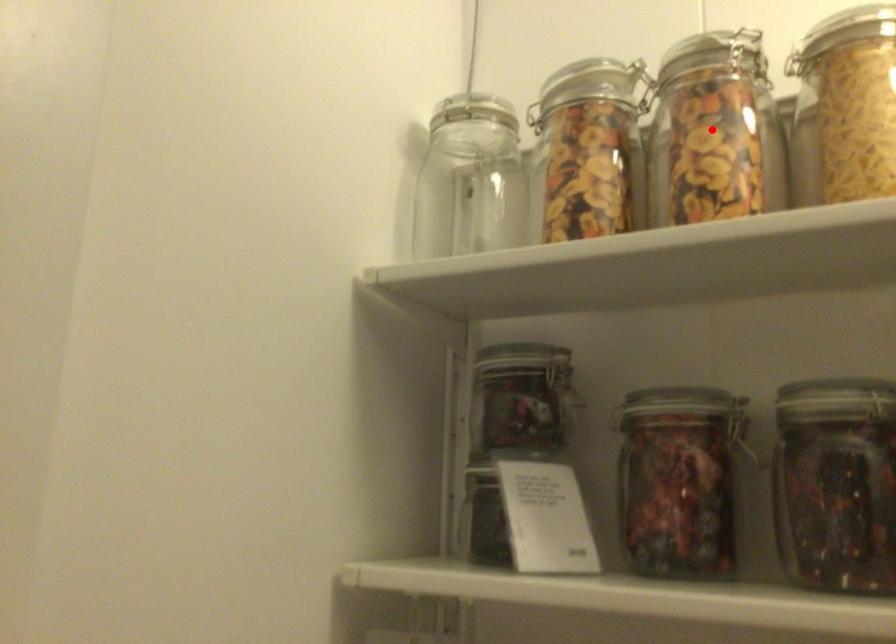
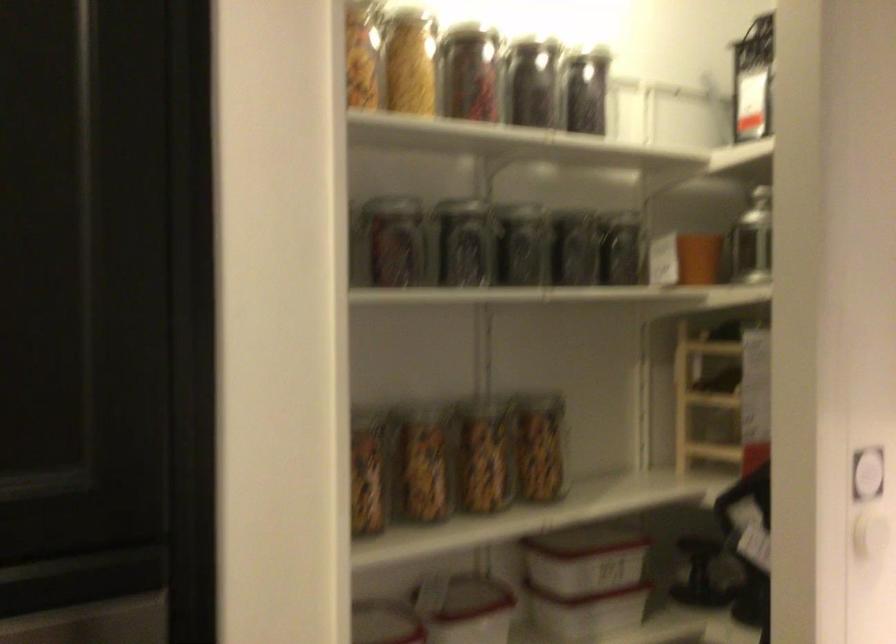
Question: I am providing you with two images of the same scene from different viewpoints. A red point is marked on the first image. Can you still see the location of the red point in image 2?

Choices:
 (A) Yes
 (B) No

Answer: (A)